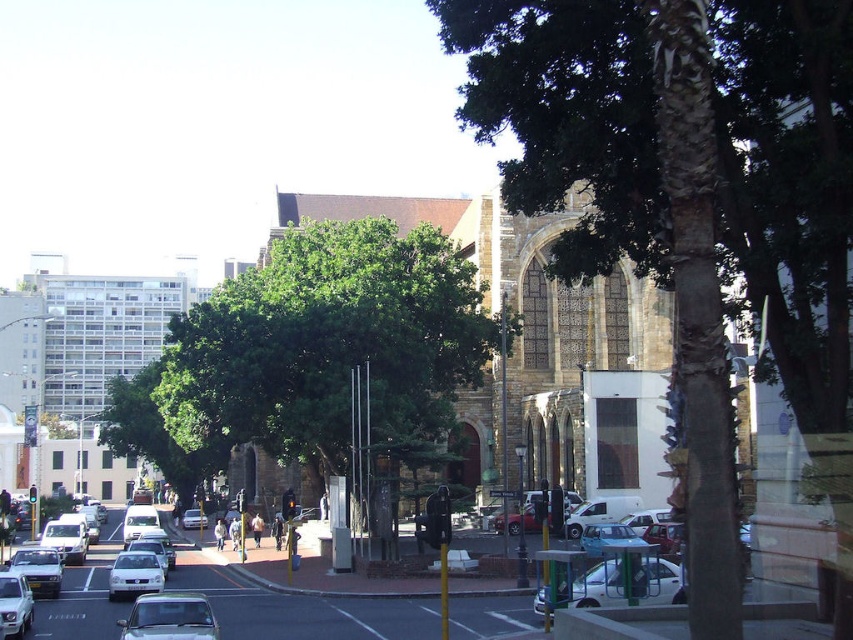
In the scene shown: Can you confirm if green leafy tree at center is shorter than brown stone church at center?

Correct, green leafy tree at center is not as tall as brown stone church at center.

Which is in front, point (285, 381) or point (653, 292)?

Point (285, 381)

Where is `green leafy tree at center`? This screenshot has width=853, height=640. green leafy tree at center is located at coordinates (331, 348).

Between point (10, 609) and point (47, 545), which one is positioned in front?

Positioned in front is point (10, 609).

What do you see at coordinates (15, 604) in the screenshot? I see `white glossy car at lower left` at bounding box center [15, 604].

What are the coordinates of `white glossy car at lower left` in the screenshot? It's located at tap(15, 604).

Which is below, brown stone church at center or metallic silver car at center?

metallic silver car at center

Based on the photo, between brown stone church at center and metallic silver car at center, which one appears on the right side from the viewer's perspective?

Positioned to the right is brown stone church at center.

Is point (543, 413) less distant than point (154, 625)?

No, it is not.

In order to click on brown stone church at center in this screenshot , I will do `click(526, 300)`.